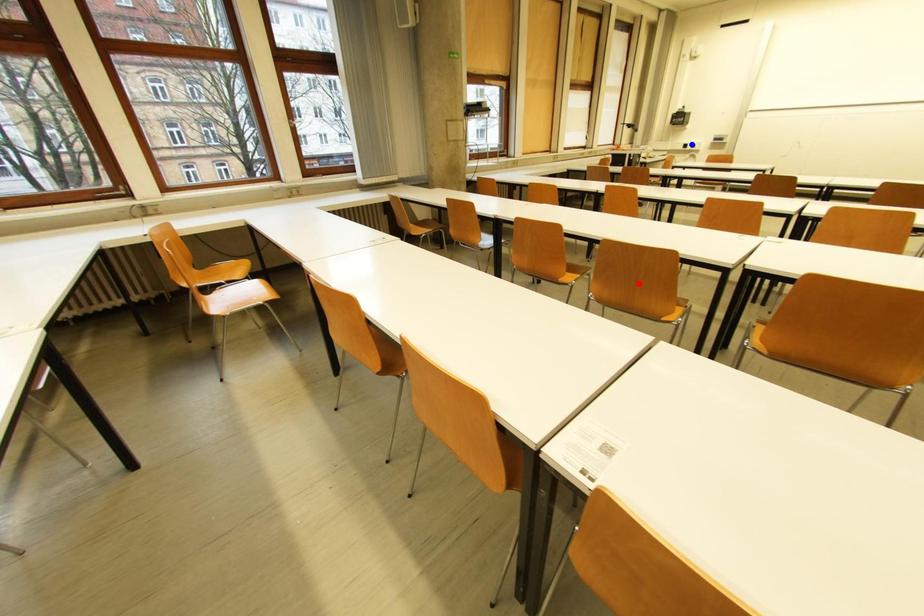
Question: In the image, two points are highlighted. Which point is nearer to the camera? Reply with the corresponding letter.

Choices:
 (A) blue point
 (B) red point

Answer: (B)